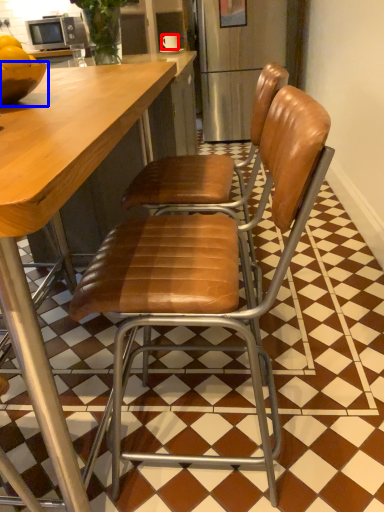
Question: Among these objects, which one is nearest to the camera, coffee cup (highlighted by a red box) or bowl (highlighted by a blue box)?

Choices:
 (A) coffee cup
 (B) bowl

Answer: (B)